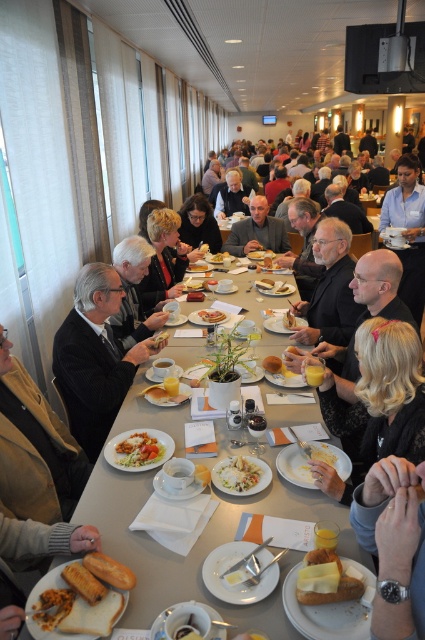
You are a server carrying a tray of dishes. You need to place the dishes on the table between the matte black suit at center and the yellow bread at table center. Is there enough space to place the dishes?

The distance between the matte black suit at center and the yellow bread at table center is 25.43 inches, so there is sufficient space to place the dishes between them.

You are a guest at the table and want to reach for the yellow cheese on bread at lower center and the white creamy pasta at center. Which one is closer to your current position at the lower edge of the table?

The yellow cheese on bread at lower center is closer to your current position at the lower edge of the table because it is located below the white creamy pasta at center.

You are a server in the room and need to deliver a drink to the person wearing the matte black suit at center. The drink needs to be placed on the table near the yellow bread at table center. Based on the scene description, can you place the drink in the correct location without moving the bread?

Yes, the drink can be placed near the yellow bread at table center because the matte black suit at center is to the right of the yellow bread, so placing the drink to the left of the bread would still be near it while avoiding moving the bread.